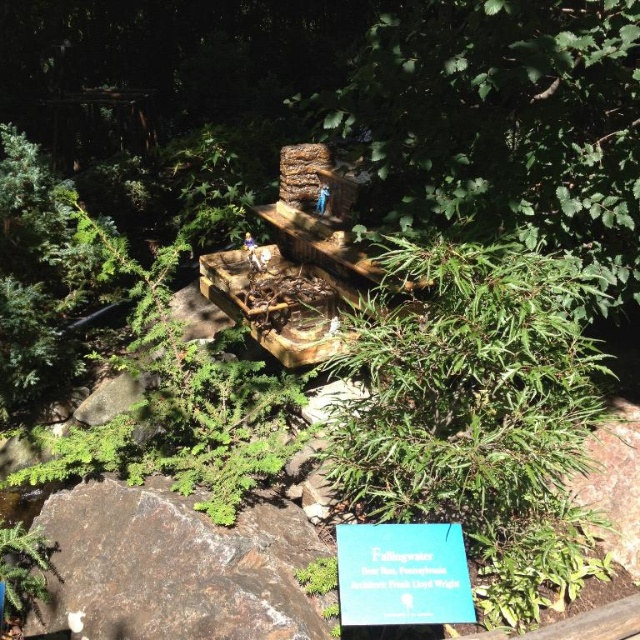
You are a visitor at the model of Fallingwater and want to take a photo of the green leafy tree at center and the blue paper sign at lower center. Which object should you focus on first if you want to capture both in a single frame without moving the camera?

The green leafy tree at center is taller than the blue paper sign at lower center, so you should focus on the green leafy tree at center first to ensure both are in frame.

You are standing at the origin point in this miniature model of Fallingwater. You want to locate the green leafy tree at center. What are its coordinates?

The green leafy tree at center is located at coordinates (x=500, y=124).

You are standing in front of the miniature model of Fallingwater. You notice two points marked in the scene. The first point is at coordinates point (561, 13) and the second is at point (13, 538). Which point is closer to you?

Point (561, 13) is further to the viewer than point (13, 538), so the closer point to you is point (13, 538).